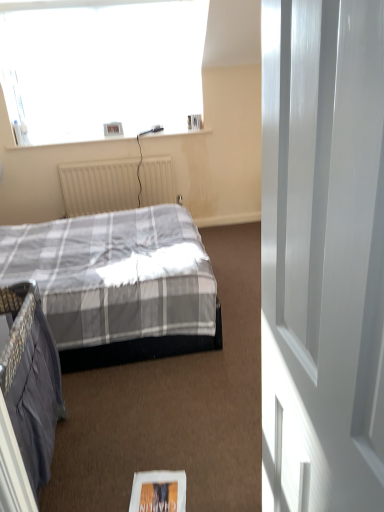
Locate an element on the screen. The image size is (384, 512). white glossy door at right is located at coordinates (322, 254).

From the image's perspective, is beige textured radiator at center located above or below white glossy door at right?

Clearly, from the image's perspective, beige textured radiator at center is above white glossy door at right.

Could you tell me if beige textured radiator at center is facing white glossy door at right?

Yes, beige textured radiator at center faces towards white glossy door at right.

Consider the image. Between beige textured radiator at center and white glossy door at right, which one has more height?

white glossy door at right.

In the scene shown: Which is behind, beige textured radiator at center or white glossy door at right?

beige textured radiator at center is further away from the camera.

Considering the sizes of objects beige textured radiator at center and white paper magazine at lower center in the image provided, who is taller, beige textured radiator at center or white paper magazine at lower center?

beige textured radiator at center is taller.

Considering the relative sizes of beige textured radiator at center and white paper magazine at lower center in the image provided, is beige textured radiator at center thinner than white paper magazine at lower center?

Indeed, beige textured radiator at center has a lesser width compared to white paper magazine at lower center.

Does point (169, 175) come behind point (162, 501)?

Yes.

Is beige textured radiator at center behind white paper magazine at lower center?

Yes, it is behind white paper magazine at lower center.

From the image's perspective, is white glossy door at right on top of beige textured radiator at center?

Incorrect, from the image's perspective, white glossy door at right is lower than beige textured radiator at center.

Would you say white glossy door at right is inside or outside beige textured radiator at center?

white glossy door at right is outside beige textured radiator at center.

Which object is positioned more to the left, white glossy door at right or beige textured radiator at center?

From the viewer's perspective, beige textured radiator at center appears more on the left side.

From the picture: Considering the relative positions of white glossy door at right and beige textured radiator at center in the image provided, is white glossy door at right in front of beige textured radiator at center?

Yes, it is in front of beige textured radiator at center.

Who is smaller, white paper magazine at lower center or white glossy door at right?

With smaller size is white paper magazine at lower center.

Do you think white paper magazine at lower center is within white glossy door at right, or outside of it?

white paper magazine at lower center is spatially situated outside white glossy door at right.

Identify the location of screen door above the white paper magazine at lower center (from a real-world perspective). (322, 254).

Which is correct: white paper magazine at lower center is inside beige textured radiator at center, or outside of it?

white paper magazine at lower center is spatially situated outside beige textured radiator at center.

From the image's perspective, which is below, white paper magazine at lower center or beige textured radiator at center?

white paper magazine at lower center appears lower in the image.

From a real-world perspective, is white paper magazine at lower center physically above beige textured radiator at center?

No, from a real-world perspective, white paper magazine at lower center is not over beige textured radiator at center

Which is closer, (x=176, y=489) or (x=149, y=172)?

Point (x=176, y=489)

Image resolution: width=384 pixels, height=512 pixels. What are the coordinates of `screen door above the white paper magazine at lower center (from a real-world perspective)` in the screenshot? It's located at click(322, 254).

In the scene shown: Considering the sizes of objects white glossy door at right and white paper magazine at lower center in the image provided, who is taller, white glossy door at right or white paper magazine at lower center?

→ white glossy door at right.

Can you confirm if white glossy door at right is positioned to the right of white paper magazine at lower center?

Correct, you'll find white glossy door at right to the right of white paper magazine at lower center.

Which object is closer to the camera taking this photo, white glossy door at right or white paper magazine at lower center?

white glossy door at right is in front.

I want to click on radiator that appears on the left of white glossy door at right, so click(115, 185).

In order to click on radiator behind the white paper magazine at lower center in this screenshot , I will do `click(115, 185)`.

Which object lies further to the anchor point white glossy door at right, beige textured radiator at center or white paper magazine at lower center?

Among the two, beige textured radiator at center is located further to white glossy door at right.

From the image, which object appears to be farther from white glossy door at right, white paper magazine at lower center or beige textured radiator at center?

beige textured radiator at center is positioned further to the anchor white glossy door at right.

In the scene shown: Estimate the real-world distances between objects in this image. Which object is further from beige textured radiator at center, white paper magazine at lower center or white glossy door at right?

The object further to beige textured radiator at center is white glossy door at right.

From the image, which object appears to be farther from beige textured radiator at center, white glossy door at right or white paper magazine at lower center?

white glossy door at right is further to beige textured radiator at center.

From the image, which object appears to be nearer to white paper magazine at lower center, white glossy door at right or beige textured radiator at center?

white glossy door at right is closer to white paper magazine at lower center.

Looking at this image, from the image, which object appears to be nearer to white paper magazine at lower center, beige textured radiator at center or white glossy door at right?

Among the two, white glossy door at right is located nearer to white paper magazine at lower center.

The width and height of the screenshot is (384, 512). Find the location of `magazine between white glossy door at right and beige textured radiator at center in the front-back direction`. magazine between white glossy door at right and beige textured radiator at center in the front-back direction is located at coordinates pos(158,492).